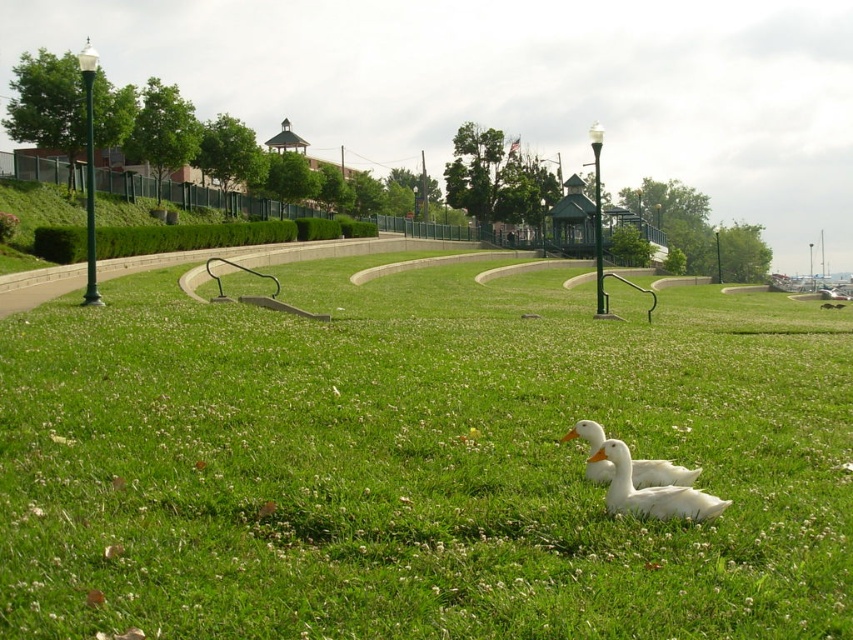
Question: Considering the relative positions of green grassy at center and white matte duck at lower right in the image provided, where is green grassy at center located with respect to white matte duck at lower right?

Choices:
 (A) above
 (B) below

Answer: (A)

Question: Is green grassy at center closer to the viewer compared to white matte duck at center?

Choices:
 (A) no
 (B) yes

Answer: (B)

Question: Based on their relative distances, which object is nearer to the white matte couple at center?

Choices:
 (A) white matte duck at center
 (B) green grassy at center
 (C) white matte duck at lower right

Answer: (B)

Question: Which object is the farthest from the white matte duck at center?

Choices:
 (A) green grassy at center
 (B) white matte duck at lower right

Answer: (A)

Question: Which point appears closest to the camera in this image?

Choices:
 (A) (619, 332)
 (B) (691, 515)
 (C) (509, 237)

Answer: (B)

Question: Can you confirm if white matte duck at center is positioned above white matte couple at center?

Choices:
 (A) yes
 (B) no

Answer: (B)